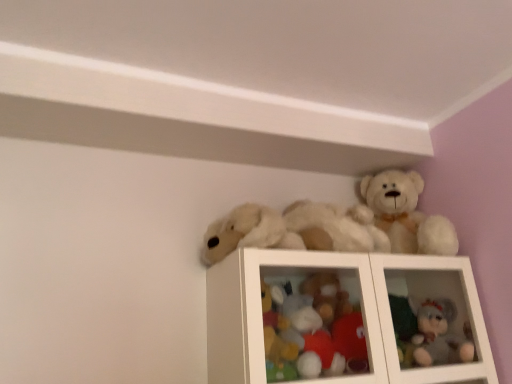
Question: In terms of size, does gray plush bear at upper right, which ranks as the third toy in left-to-right order, appear bigger or smaller than fluffy fabric teddy bear at upper right, acting as the second toy starting from the left?

Choices:
 (A) small
 (B) big

Answer: (B)

Question: From a real-world perspective, is gray plush bear at upper right, the first toy positioned from the right, positioned above or below fluffy fabric teddy bear at upper right, acting as the second toy starting from the left?

Choices:
 (A) below
 (B) above

Answer: (A)

Question: Which object is positioned closest to the fluffy fabric teddy bear at upper right, acting as the second toy starting from the left?

Choices:
 (A) gray plush bear at upper right, the first toy positioned from the right
 (B) white plush bear at upper center, the third toy viewed from the right

Answer: (B)

Question: Considering the real-world distances, which object is closest to the gray plush bear at upper right, which ranks as the third toy in left-to-right order?

Choices:
 (A) white plush bear at upper center, which is the first toy in left-to-right order
 (B) fluffy fabric teddy bear at upper right, which is the 2th toy from right to left

Answer: (B)